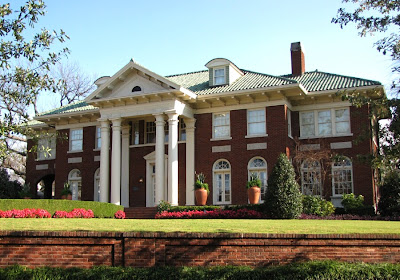
This screenshot has width=400, height=280. I want to click on 3 colors in house, so click(x=118, y=144), click(x=220, y=147), click(x=190, y=82).